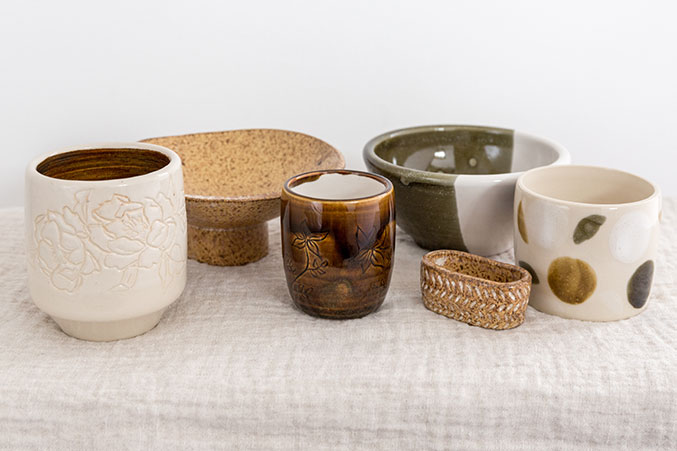
Identify the location of brown coffee cup. Image resolution: width=677 pixels, height=451 pixels. pos(336,220).